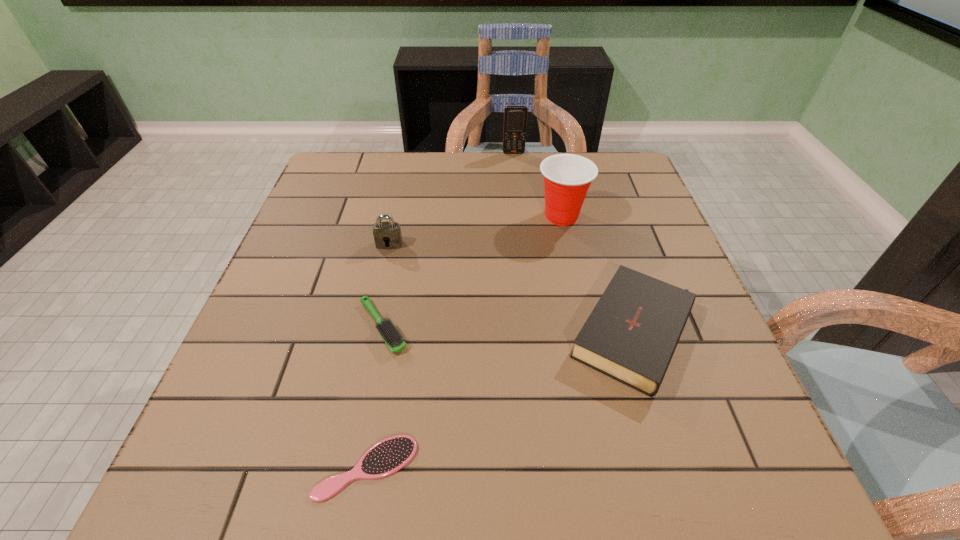
The width and height of the screenshot is (960, 540). I want to click on free space that is in between the padlock and the second shortest object, so click(386, 286).

What are the coordinates of `vacant space that is in between the padlock and the farther hairbrush` in the screenshot? It's located at (386, 286).

Where is `vacant area between the fourth nearest object and the Bible`? Image resolution: width=960 pixels, height=540 pixels. vacant area between the fourth nearest object and the Bible is located at coordinates (513, 289).

Where is `empty space between the Bible and the third object from right to left`? empty space between the Bible and the third object from right to left is located at coordinates (575, 243).

At what (x,y) coordinates should I click in order to perform the action: click on unoccupied area between the Bible and the shortest object. Please return your answer as a coordinate pair (x, y). This screenshot has width=960, height=540. Looking at the image, I should click on (501, 401).

Identify which object is the third closest to the second farthest object. Please provide its 2D coordinates. Your answer should be formatted as a tuple, i.e. [(x, y)], where the tuple contains the x and y coordinates of a point satisfying the conditions above.

[(387, 235)]

Find the location of a particular element. Image resolution: width=960 pixels, height=540 pixels. object that is the second closest to the taller hairbrush is located at coordinates (387, 235).

Locate an element on the screen. Image resolution: width=960 pixels, height=540 pixels. vacant space that satisfies the following two spatial constraints: 1. on the screen of the cup; 2. on the left side of the cellular telephone is located at coordinates (520, 216).

In order to click on vacant area that satisfies the following two spatial constraints: 1. on the front side of the farther hairbrush; 2. on the left side of the shortest object in this screenshot , I will do `click(354, 468)`.

Locate an element on the screen. The image size is (960, 540). vacant area in the image that satisfies the following two spatial constraints: 1. at the front of the padlock near the keyhole; 2. on the left side of the Bible is located at coordinates (370, 333).